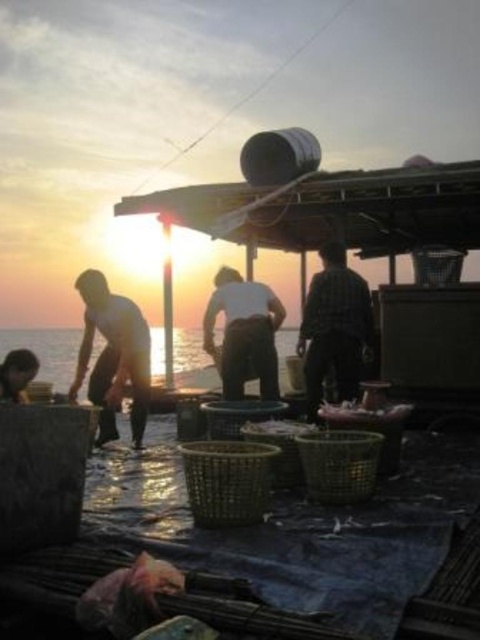
Which is below, smooth brown skin at lower left or shiny silver fish at lower center?

shiny silver fish at lower center

Can you confirm if smooth brown skin at lower left is thinner than shiny silver fish at lower center?

No.

Describe the element at coordinates (16, 372) in the screenshot. The image size is (480, 640). I see `smooth brown skin at lower left` at that location.

Locate an element on the screen. The height and width of the screenshot is (640, 480). smooth brown skin at lower left is located at coordinates (16, 372).

Measure the distance from silhouette fabric fisherman at center to smooth brown skin at lower left.

The distance of silhouette fabric fisherman at center from smooth brown skin at lower left is 1.94 meters.

Does silhouette fabric fisherman at center appear under smooth brown skin at lower left?

No, silhouette fabric fisherman at center is not below smooth brown skin at lower left.

Who is more distant from viewer, (236, 326) or (6, 360)?

The point (236, 326) is behind.

At what (x,y) coordinates should I click in order to perform the action: click on silhouette fabric fisherman at center. Please return your answer as a coordinate pair (x, y). Looking at the image, I should click on (244, 333).

Does flannel shirt at center lie behind silhouette fabric fisherman at center?

No, flannel shirt at center is in front of silhouette fabric fisherman at center.

Who is more distant from viewer, (x=344, y=348) or (x=254, y=284)?

The point (x=254, y=284) is more distant.

Locate an element on the screen. This screenshot has height=640, width=480. flannel shirt at center is located at coordinates point(335,326).